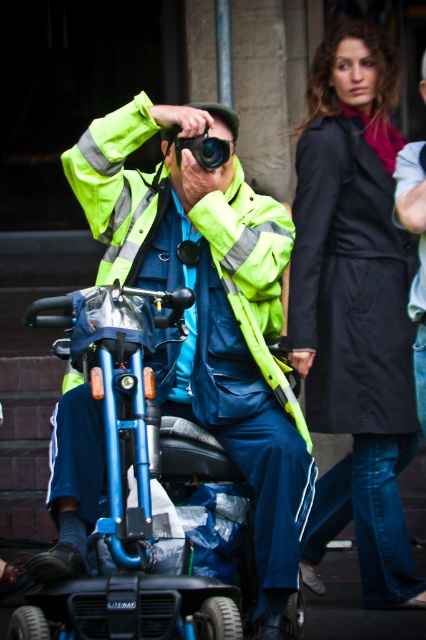
Question: Is neon yellow reflective jacket at center below black matte coat at upper right?

Choices:
 (A) yes
 (B) no

Answer: (B)

Question: Can you confirm if neon yellow reflective jacket at center is positioned above black matte coat at upper right?

Choices:
 (A) no
 (B) yes

Answer: (B)

Question: Among these points, which one is nearest to the camera?

Choices:
 (A) pos(86,480)
 (B) pos(339,294)

Answer: (A)

Question: Which of the following is the closest to the observer?

Choices:
 (A) neon yellow reflective jacket at center
 (B) black matte coat at upper right

Answer: (A)

Question: Is neon yellow reflective jacket at center positioned in front of black matte coat at upper right?

Choices:
 (A) no
 (B) yes

Answer: (B)